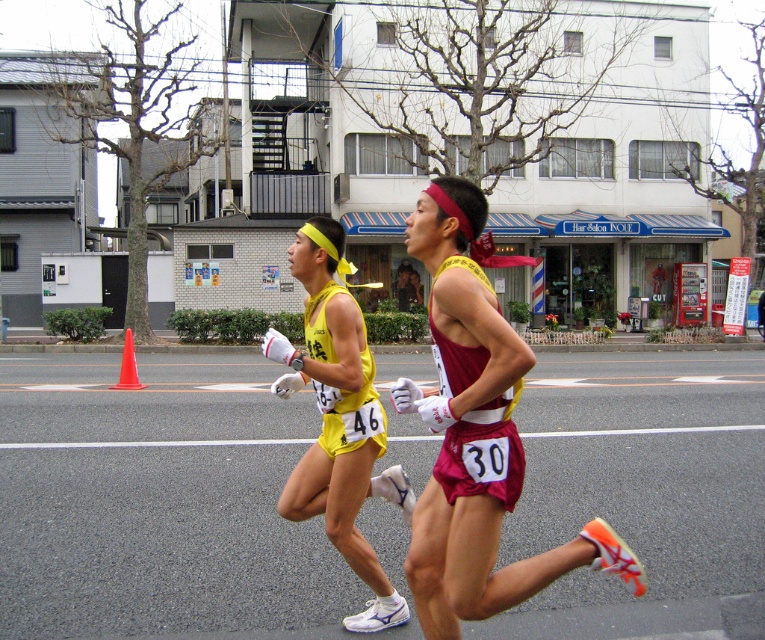
This screenshot has width=765, height=640. Describe the element at coordinates (337, 419) in the screenshot. I see `yellow fabric shorts at center` at that location.

Find the location of a particular element. Image resolution: width=765 pixels, height=640 pixels. yellow fabric shorts at center is located at coordinates tap(337, 419).